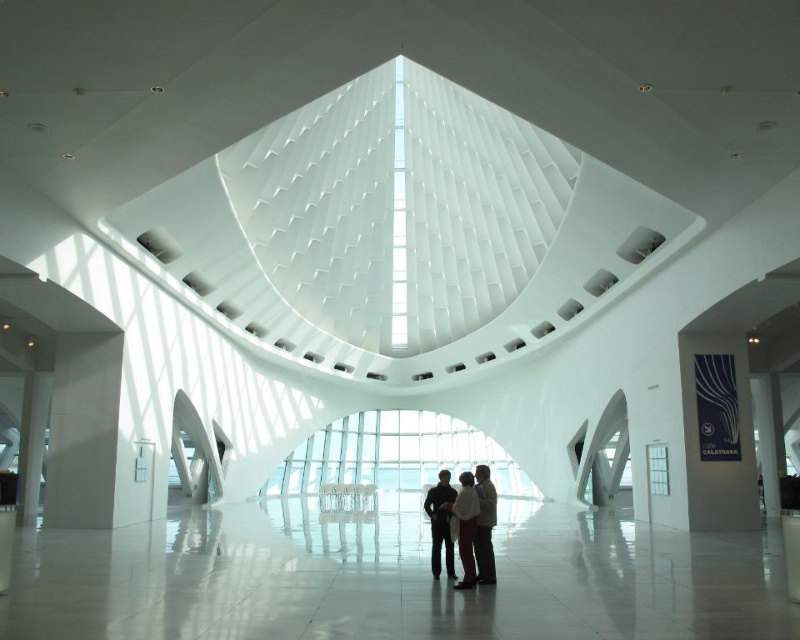
Question: Among these objects, which one is farthest from the camera?

Choices:
 (A) dark brown leather jacket at center
 (B) light beige fabric coat at center

Answer: (B)

Question: Is dark brown leather jacket at center wider than dark blue fabric jacket at center?

Choices:
 (A) yes
 (B) no

Answer: (A)

Question: Which object appears closest to the camera in this image?

Choices:
 (A) dark blue fabric jacket at center
 (B) dark brown leather jacket at center
 (C) white fabric coat at center
 (D) light beige fabric coat at center

Answer: (C)

Question: Estimate the real-world distances between objects in this image. Which object is farther from the light beige fabric coat at center?

Choices:
 (A) dark brown leather jacket at center
 (B) dark blue fabric jacket at center

Answer: (B)

Question: Does dark blue fabric jacket at center have a lesser width compared to light beige fabric coat at center?

Choices:
 (A) no
 (B) yes

Answer: (B)

Question: Does dark brown leather jacket at center come behind light beige fabric coat at center?

Choices:
 (A) no
 (B) yes

Answer: (A)